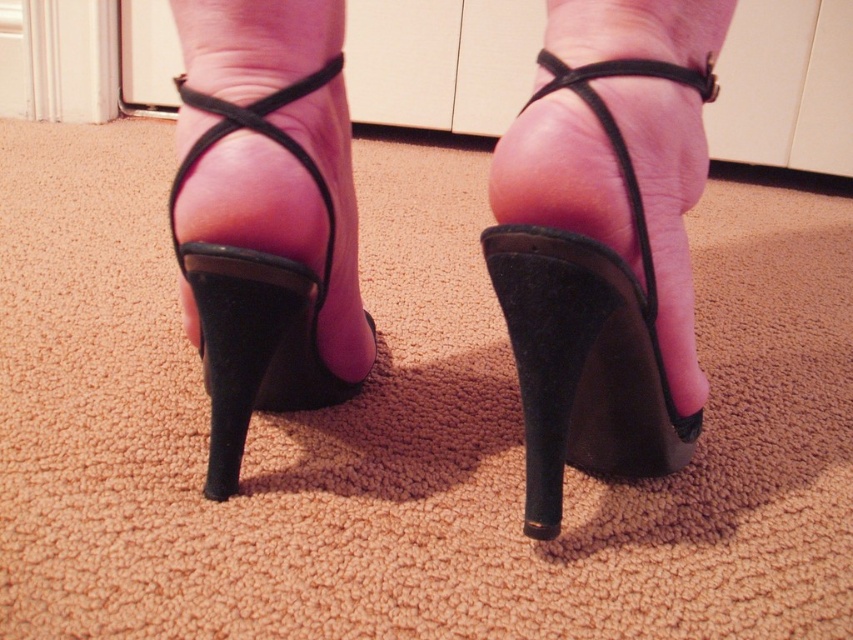
Who is more forward, (695, 376) or (306, 170)?

Point (306, 170)

Does point (524, 112) come farther from viewer compared to point (318, 280)?

No, (524, 112) is in front of (318, 280).

At what (x,y) coordinates should I click in order to perform the action: click on black leather high heels at center. Please return your answer as a coordinate pair (x, y). This screenshot has width=853, height=640. Looking at the image, I should click on (605, 237).

Can you confirm if black leather high heels at center is bigger than black suede heel at lower center?

Correct, black leather high heels at center is larger in size than black suede heel at lower center.

Can you confirm if black leather high heels at center is positioned above black suede heel at lower center?

Correct, black leather high heels at center is located above black suede heel at lower center.

Is point (287, 116) positioned behind point (531, 525)?

No, (287, 116) is closer to viewer.

The image size is (853, 640). I want to click on black leather high heels at center, so click(x=605, y=237).

Can you confirm if black suede sandal at center is positioned to the left of black suede heel at lower center?

In fact, black suede sandal at center is to the right of black suede heel at lower center.

Does point (575, 424) lie in front of point (541, 525)?

No, (575, 424) is behind (541, 525).

Find the location of a particular element. The image size is (853, 640). black suede sandal at center is located at coordinates pos(589,323).